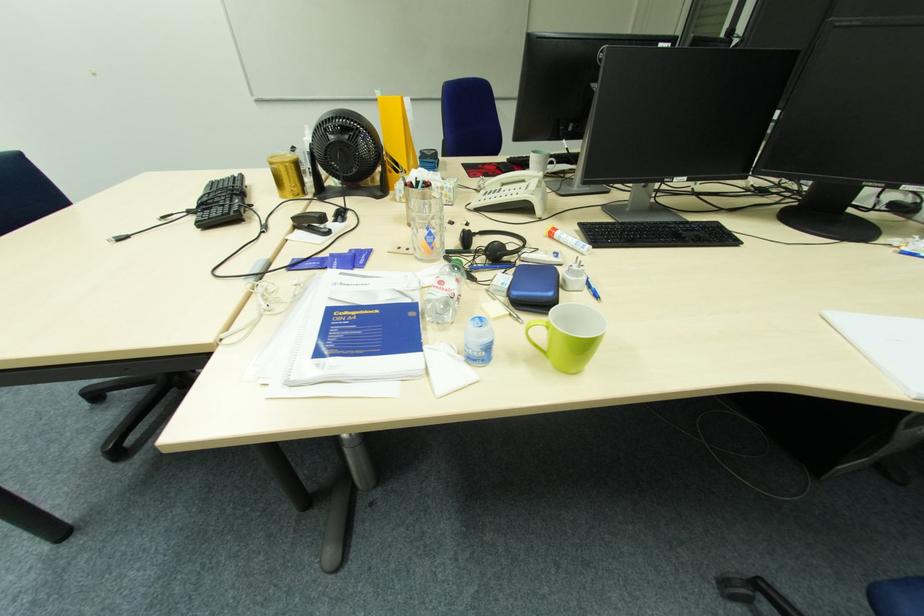
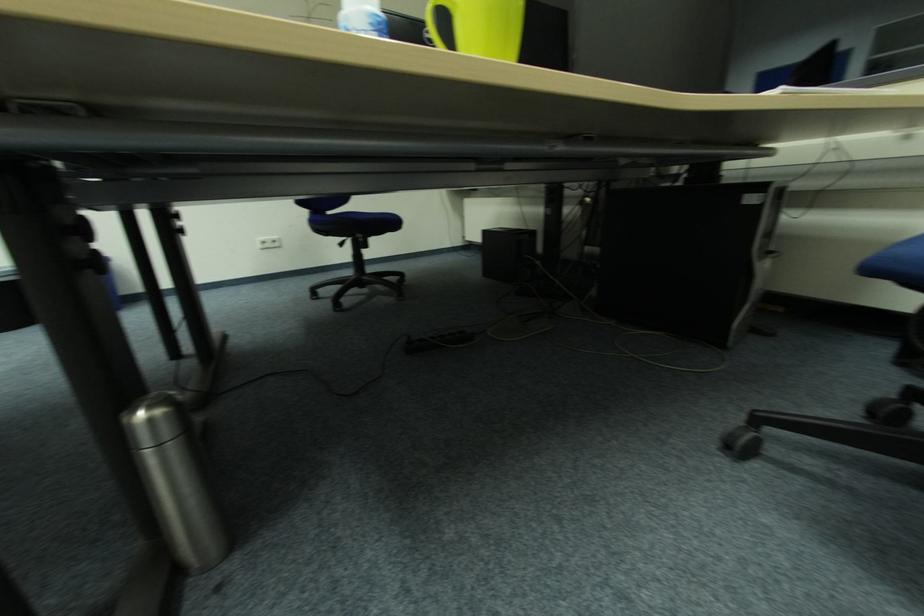
The first image is from the beginning of the video and the second image is from the end. How did the camera likely rotate when shooting the video?

The rotation direction of the camera is right-up.